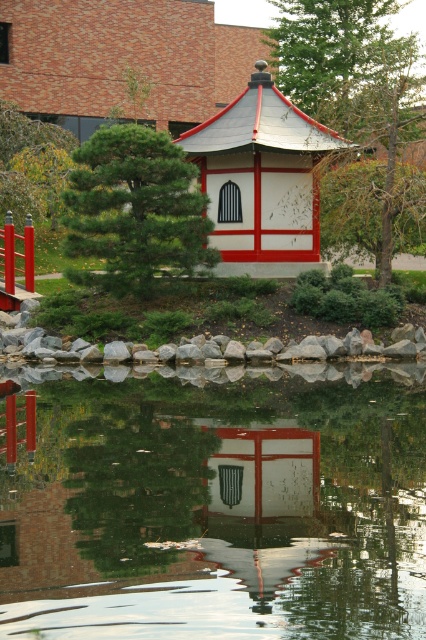
Question: Which point appears closest to the camera in this image?

Choices:
 (A) (51, 225)
 (B) (273, 586)

Answer: (B)

Question: Is green textured pine tree at center to the left of green leafy tree at upper left from the viewer's perspective?

Choices:
 (A) yes
 (B) no

Answer: (B)

Question: Which object is farther from the camera taking this photo?

Choices:
 (A) white matte gazebo at center
 (B) green leafy tree at center

Answer: (A)

Question: Which point is farther to the camera?

Choices:
 (A) white matte gazebo at center
 (B) green textured tree at upper center
 (C) green leafy tree at upper left

Answer: (B)

Question: Is white matte gazebo at center bigger than green textured tree at upper center?

Choices:
 (A) no
 (B) yes

Answer: (A)

Question: Is green textured pine tree at center wider than white matte gazebo at center?

Choices:
 (A) yes
 (B) no

Answer: (A)